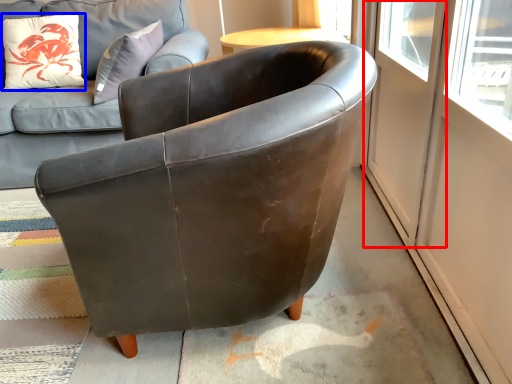
Question: Which object is further to the camera taking this photo, screen door (highlighted by a red box) or pillow (highlighted by a blue box)?

Choices:
 (A) screen door
 (B) pillow

Answer: (B)